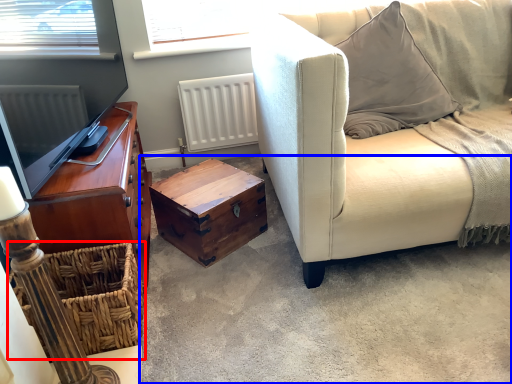
Question: Among these objects, which one is nearest to the camera, crate (highlighted by a red box) or concrete (highlighted by a blue box)?

Choices:
 (A) crate
 (B) concrete

Answer: (B)